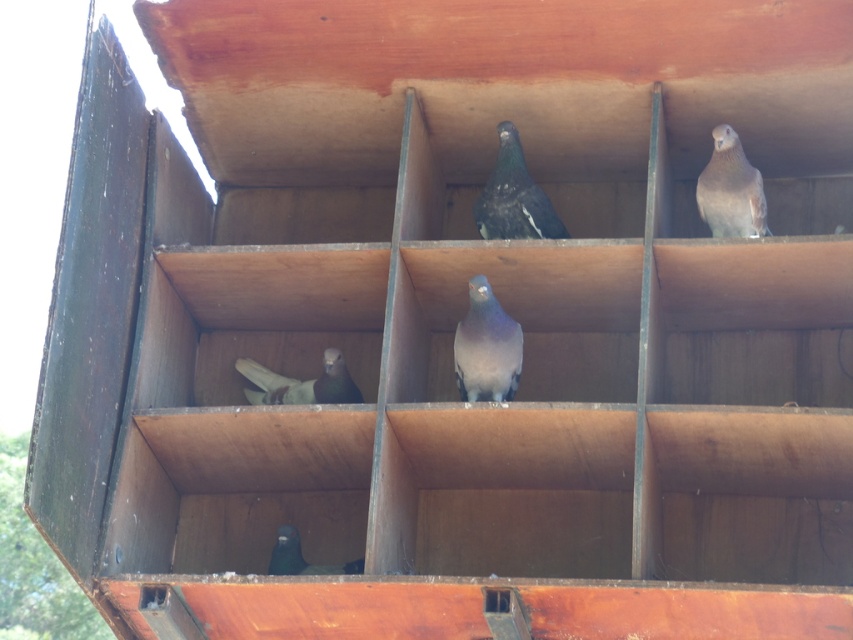
You are a birdwatcher observing the wooden pigeon coop. You notice a gray matte pigeon at upper right and a dark gray matte pigeon at lower center. Which pigeon is positioned more to the east side of the coop?

The gray matte pigeon at upper right is positioned more to the east side of the coop since it is to the right of the dark gray matte pigeon at lower center. In a typical image orientation, right corresponds to east.

You are a birdwatcher observing the pigeons in the wooden pigeon coop. You notice the gray matte pigeon at upper right and the shiny black pigeon at lower center. Which of these two pigeons is taller?

The gray matte pigeon at upper right is taller than the shiny black pigeon at lower center.

You are standing in front of the wooden pigeon coop and notice the shiny dark blue pigeon at center. If you want to take a photo of it with your phone, which has a maximum zoom range of 20 meters, will you be able to capture it clearly without moving closer?

The shiny dark blue pigeon at center is 26.00 meters away from the camera. Since your phone has a maximum zoom range of 20 meters, you won cannot capture it clearly without moving closer.